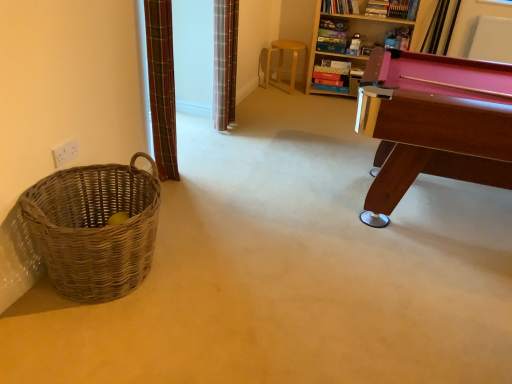
Where is `vacant space that is in between pink wood pool table at right and woven brown basket at left`? The height and width of the screenshot is (384, 512). vacant space that is in between pink wood pool table at right and woven brown basket at left is located at coordinates (305, 240).